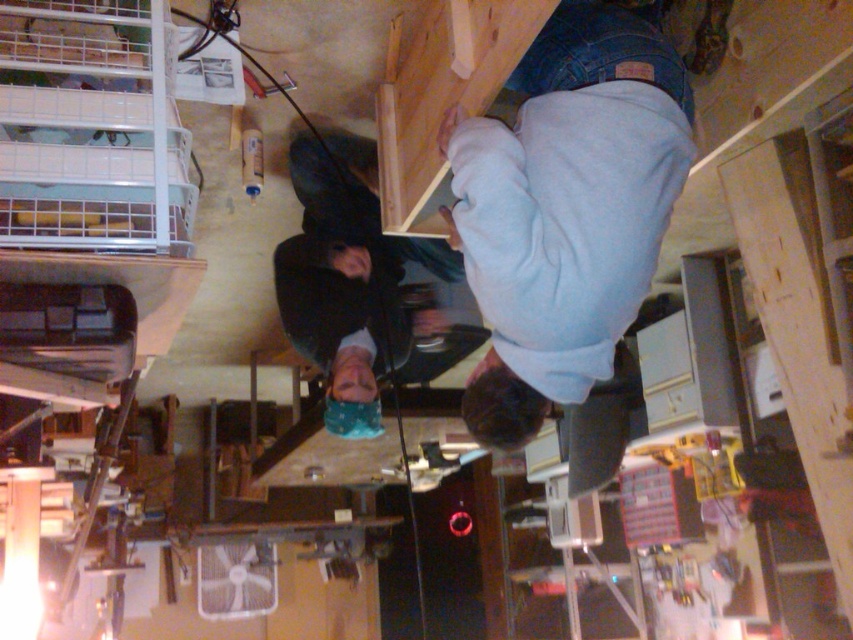
You are a delivery person who needs to place a package between the light blue cotton shirt at upper center and the nearest wall. The package is 4 feet long. Will it fit?

The distance between the light blue cotton shirt at upper center and the nearest wall is 3.98 feet, so the 4 feet long package will not fit between them.

You are standing in the workshop and want to reach the light blue cotton shirt at upper center and the dark blue fabric at center. Which item is closer to you?

The light blue cotton shirt at upper center is closer to the viewer than the dark blue fabric at center.

You are standing in the rotated workshop image and need to locate the light blue cotton shirt at upper center. Based on the coordinates provided, where exactly would you look to find it?

The light blue cotton shirt at upper center is located at coordinates point 0.328 on the x axis and 0.665 on the y axis.